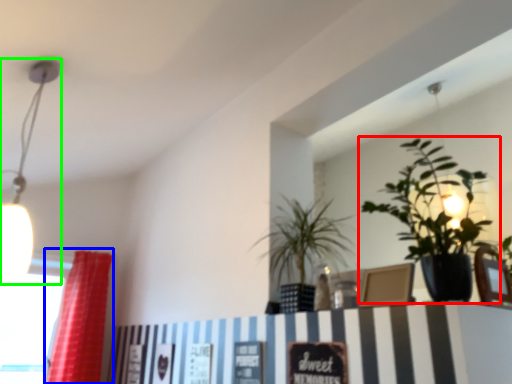
Question: Considering the real-world distances, which object is closest to houseplant (highlighted by a red box)? curtain (highlighted by a blue box) or lamp (highlighted by a green box).

Choices:
 (A) curtain
 (B) lamp

Answer: (B)